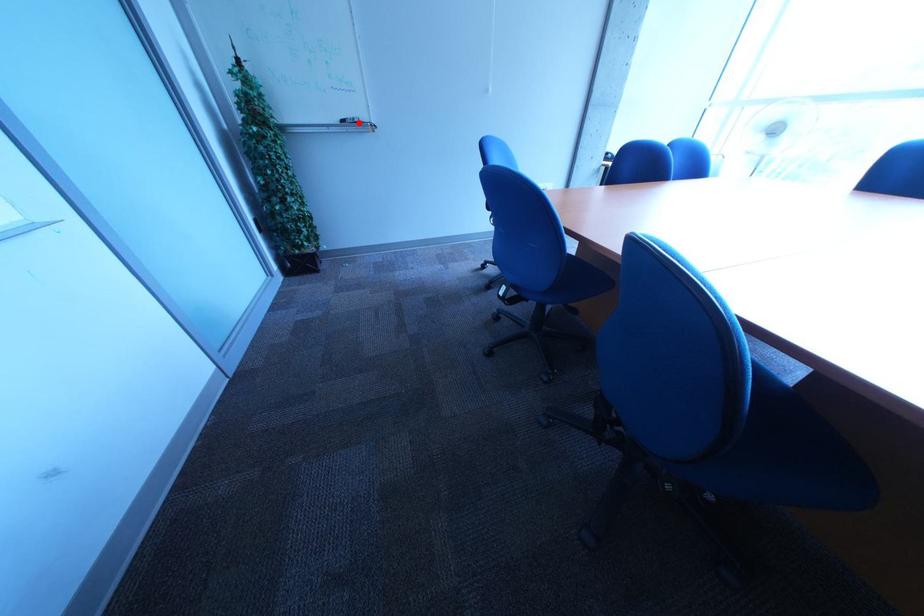
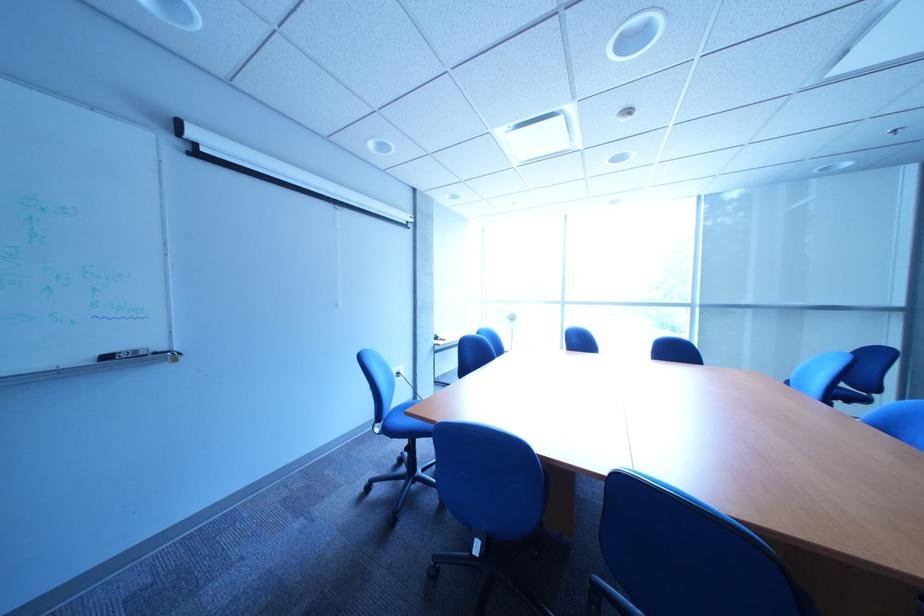
The point at the highlighted location is marked in the first image. Where is the corresponding point in the second image?

(123, 359)